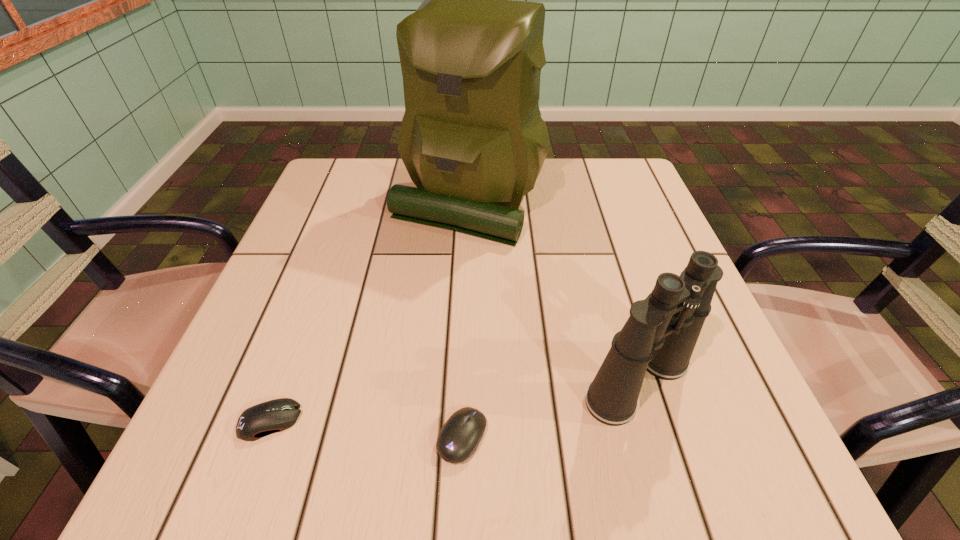
I want to click on free space at the near right corner of the desktop, so click(765, 463).

Find the location of a particular element. This screenshot has width=960, height=540. vacant area that lies between the rightmost object and the tallest object is located at coordinates (553, 291).

This screenshot has width=960, height=540. What are the coordinates of `free spot between the right computer equipment and the rightmost object` in the screenshot? It's located at (550, 409).

I want to click on vacant area that lies between the right computer equipment and the binoculars, so click(550, 409).

This screenshot has width=960, height=540. What are the coordinates of `free spot between the right computer equipment and the leftmost object` in the screenshot? It's located at (366, 429).

Find the location of a particular element. Image resolution: width=960 pixels, height=540 pixels. empty space between the tallest object and the binoculars is located at coordinates (553, 291).

Locate an element on the screen. The height and width of the screenshot is (540, 960). blank region between the right computer equipment and the backpack is located at coordinates (465, 319).

The image size is (960, 540). In order to click on vacant area that lies between the backpack and the right computer equipment in this screenshot , I will do `click(465, 319)`.

The width and height of the screenshot is (960, 540). What are the coordinates of `free space between the backpack and the second tallest object` in the screenshot? It's located at pos(553,291).

I want to click on free space between the left computer equipment and the right computer equipment, so click(x=366, y=429).